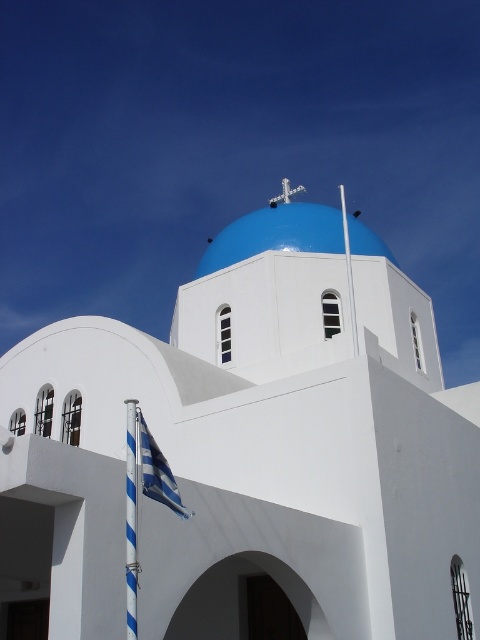
You are standing in front of the architectural structure described. You want to take a photo of the white smooth dome at center. If your camera can focus on objects up to 15 meters away, will it be able to capture the dome clearly?

The white smooth dome at center is 16.69 meters away from the viewer. Since the camera can only focus up to 15 meters, it will not be able to capture the dome clearly.